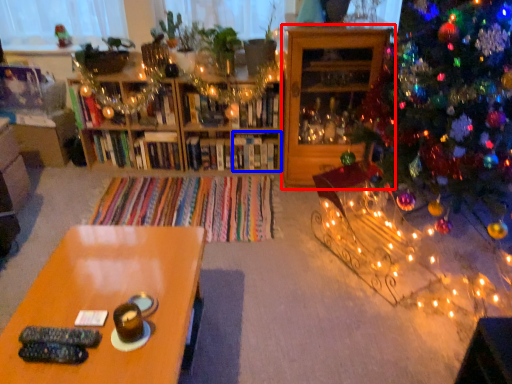
Question: Among these objects, which one is nearest to the camera, shelf (highlighted by a red box) or shelf (highlighted by a blue box)?

Choices:
 (A) shelf
 (B) shelf

Answer: (A)